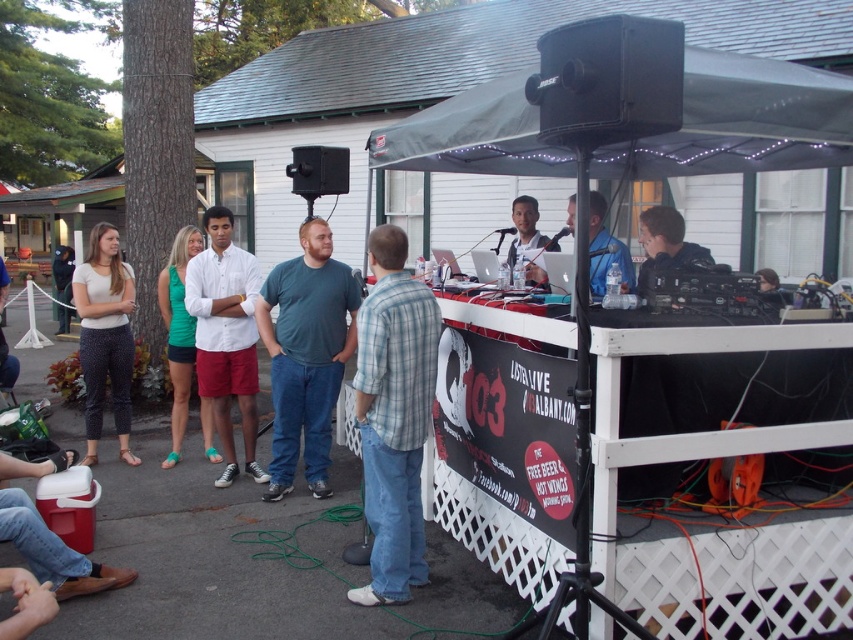
Question: Which point is closer to the camera?

Choices:
 (A) black plastic speaker at upper center
 (B) matte black laptop at upper center
 (C) teal cotton t-shirt at center

Answer: (B)

Question: Is dark gray fabric canopy at upper center further to the viewer compared to matte black laptop at upper center?

Choices:
 (A) yes
 (B) no

Answer: (B)

Question: Is blue plaid shirt at center bigger than white cotton shirt at center?

Choices:
 (A) yes
 (B) no

Answer: (B)

Question: Where is black plastic speaker at upper center located in relation to matte black laptop at upper center in the image?

Choices:
 (A) right
 (B) left

Answer: (B)

Question: Which of the following is the closest to the observer?

Choices:
 (A) black plastic speaker at upper center
 (B) blue shirt at center
 (C) blue plaid shirt at center
 (D) black leather jacket at upper right

Answer: (C)

Question: Which object is the farthest from the blue shirt at center?

Choices:
 (A) blue plaid shirt at center
 (B) matte black laptop at upper center
 (C) white cotton shirt at center

Answer: (C)